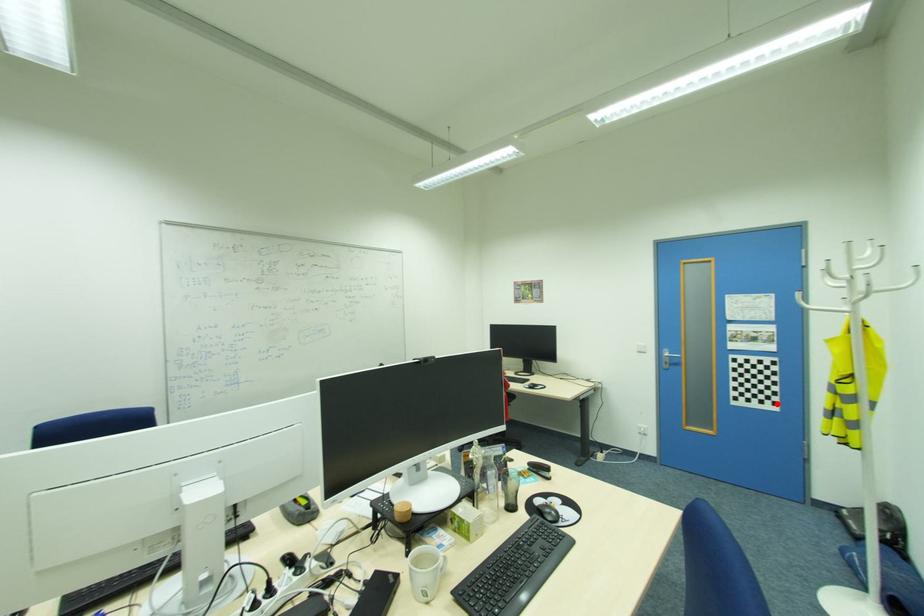
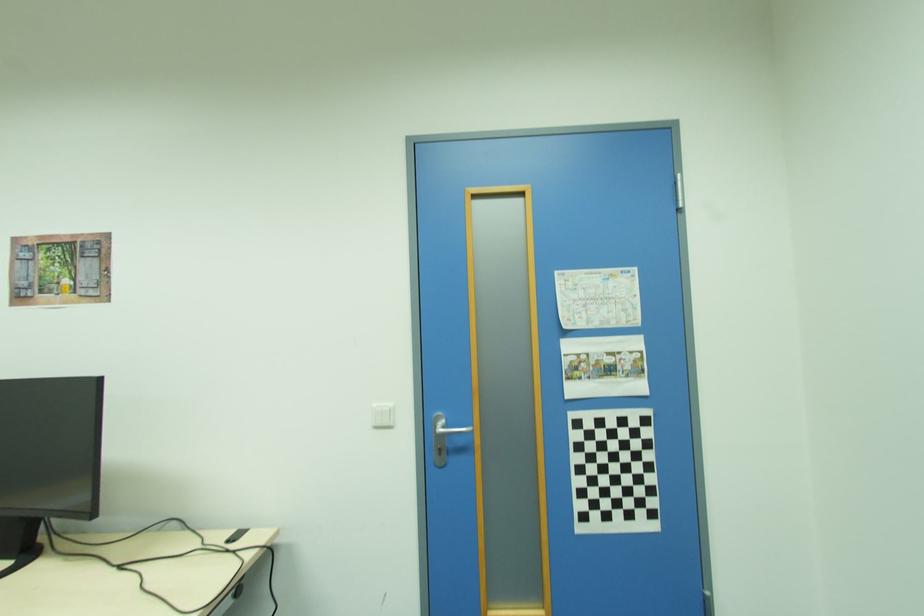
In the second image, find the point that corresponds to the highlighted location in the first image.

(655, 515)